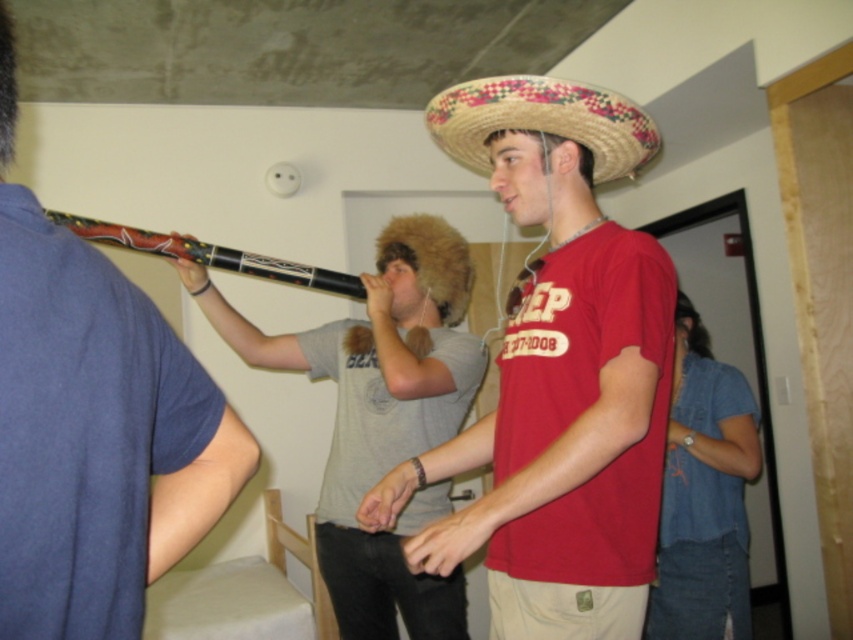
Question: Which point is farther to the camera?

Choices:
 (A) gray fur hat at center
 (B) matte black flute at upper left

Answer: (A)

Question: Is denim shirt at lower right to the right of bright straw sombrero at center from the viewer's perspective?

Choices:
 (A) no
 (B) yes

Answer: (B)

Question: Is matte black flute at upper left further to the viewer compared to denim shirt at lower right?

Choices:
 (A) no
 (B) yes

Answer: (A)

Question: Among these points, which one is farthest from the camera?

Choices:
 (A) (689, 352)
 (B) (593, 218)

Answer: (A)

Question: Does matte straw sombrero at center come in front of denim shirt at lower right?

Choices:
 (A) yes
 (B) no

Answer: (A)

Question: Considering the real-world distances, which object is closest to the denim shirt at lower right?

Choices:
 (A) matte straw sombrero at center
 (B) bright straw sombrero at center
 (C) matte black flute at upper left

Answer: (A)